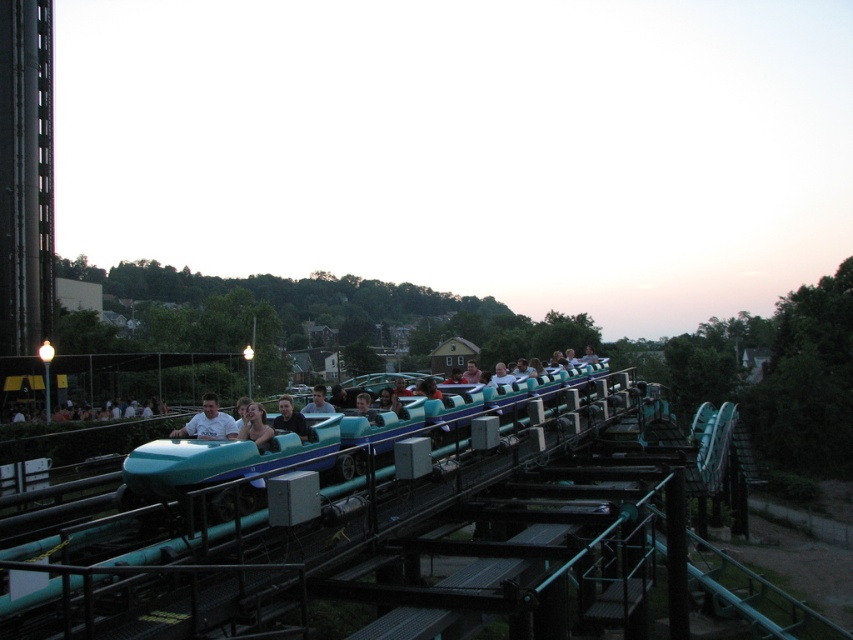
Question: Which object appears farthest from the camera in this image?

Choices:
 (A) teal glossy roller coaster rail at center
 (B) matte blue helmet at center
 (C) teal glossy roller coaster car at center

Answer: (B)

Question: Observing the image, what is the correct spatial positioning of light blue plastic helmet at center in reference to smooth blue shirt at center?

Choices:
 (A) left
 (B) right

Answer: (A)

Question: Estimate the real-world distances between objects in this image. Which object is farther from the teal glossy roller coaster car at center?

Choices:
 (A) matte blue shirt at center
 (B) light blue plastic helmet at center
 (C) teal glossy roller coaster rail at center

Answer: (B)

Question: Does teal glossy roller coaster rail at center have a smaller size compared to matte blue helmet at center?

Choices:
 (A) no
 (B) yes

Answer: (A)

Question: Which of the following is the farthest from the observer?

Choices:
 (A) (286, 397)
 (B) (45, 627)

Answer: (A)

Question: Is teal glossy roller coaster rail at center thinner than matte blue shirt at center?

Choices:
 (A) yes
 (B) no

Answer: (B)